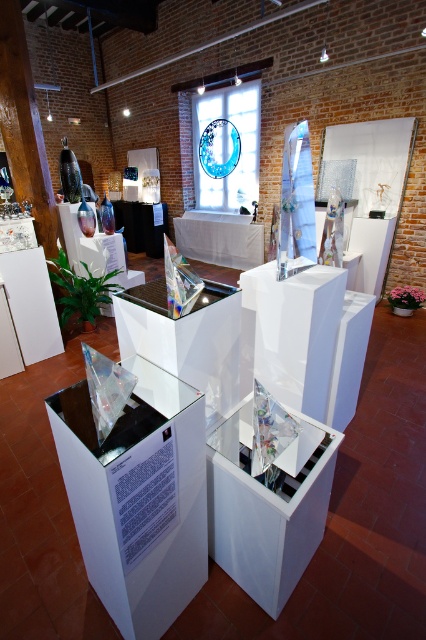
Question: Which object appears farthest from the camera in this image?

Choices:
 (A) transparent glass table at center
 (B) transparent glass sculpture at center

Answer: (A)

Question: Does transparent glass sculpture at center appear on the right side of transparent glass table at center?

Choices:
 (A) no
 (B) yes

Answer: (A)

Question: Is transparent glass sculpture at center wider than transparent glass table at center?

Choices:
 (A) yes
 (B) no

Answer: (B)

Question: Does transparent glass sculpture at center have a greater width compared to transparent glass table at center?

Choices:
 (A) no
 (B) yes

Answer: (A)